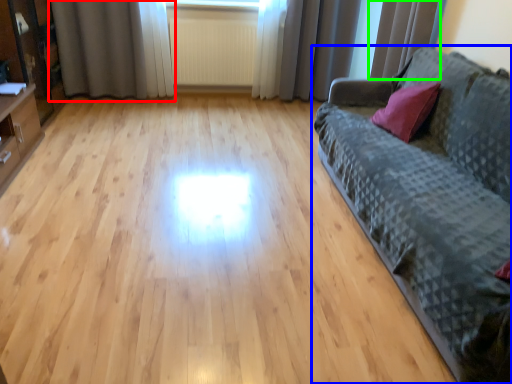
Question: Considering the real-world distances, which object is closest to curtain (highlighted by a red box)? studio couch (highlighted by a blue box) or curtain (highlighted by a green box).

Choices:
 (A) studio couch
 (B) curtain

Answer: (B)